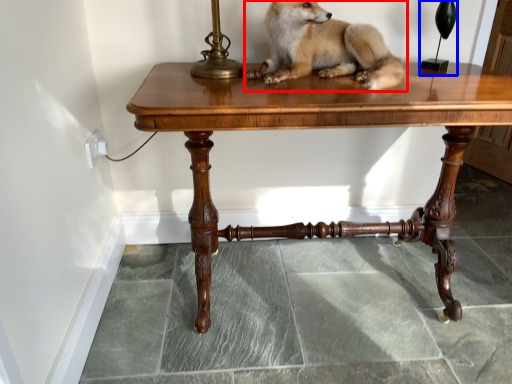
Question: Among these objects, which one is farthest to the camera, dog (highlighted by a red box) or table lamp (highlighted by a blue box)?

Choices:
 (A) dog
 (B) table lamp

Answer: (B)